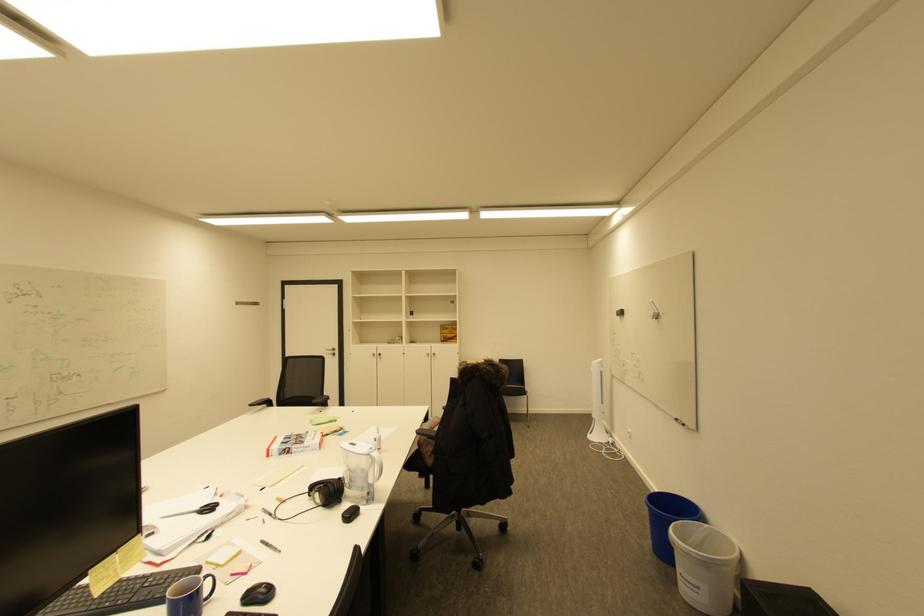
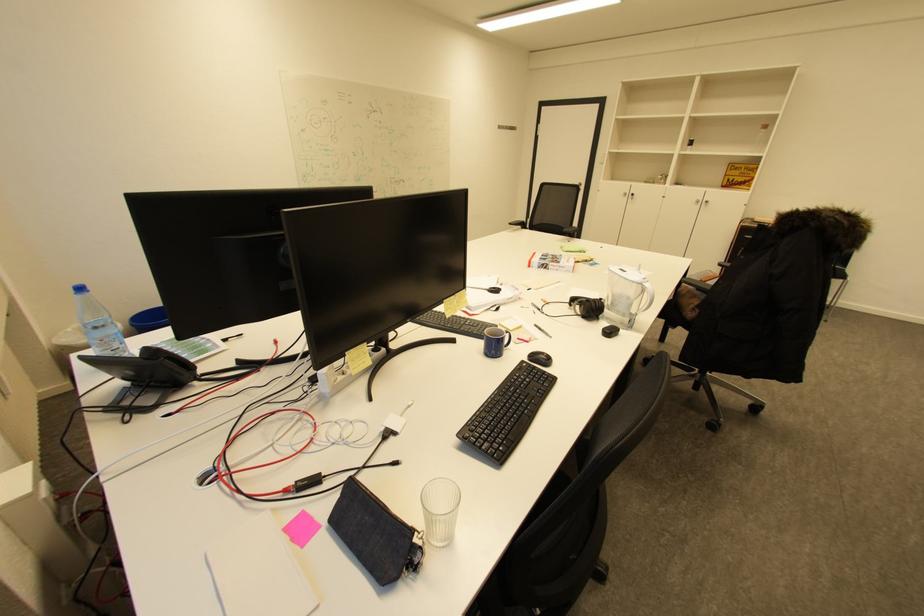
Locate, in the second image, the point that corresponds to (356,488) in the first image.

(614, 310)